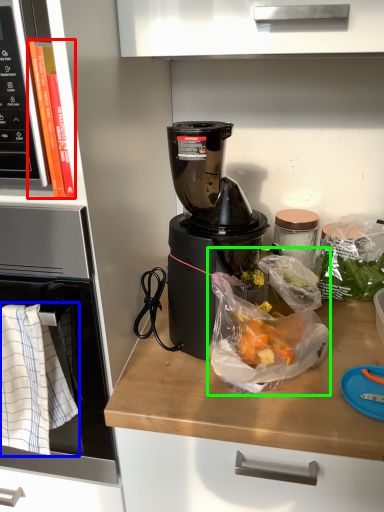
Question: Based on their relative distances, which object is farther from book (highlighted by a red box)? Choose from cloth (highlighted by a blue box) and plastic bag (highlighted by a green box).

Choices:
 (A) cloth
 (B) plastic bag

Answer: (B)